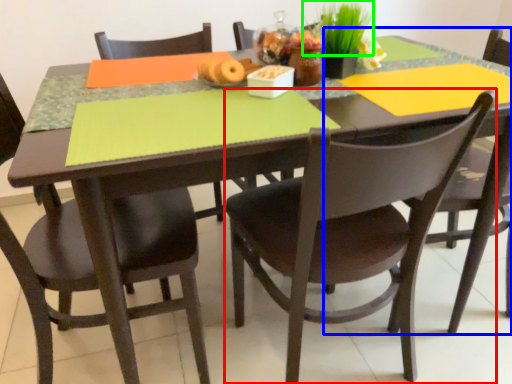
Question: Which object is the farthest from chair (highlighted by a red box)? Choose among these: chair (highlighted by a blue box) or plant (highlighted by a green box).

Choices:
 (A) chair
 (B) plant

Answer: (B)